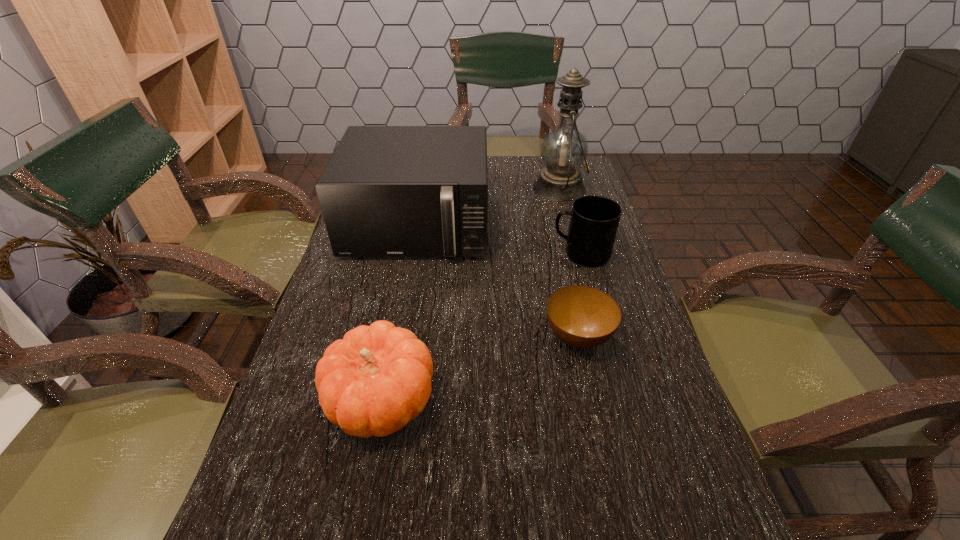
Find the location of a particular element. the tallest object is located at coordinates (564, 150).

This screenshot has height=540, width=960. In order to click on microwave oven in this screenshot , I will do `click(388, 191)`.

What are the coordinates of `mug` in the screenshot? It's located at (594, 221).

Locate an element on the screen. The width and height of the screenshot is (960, 540). pumpkin is located at coordinates (376, 379).

The height and width of the screenshot is (540, 960). I want to click on bowl, so click(584, 317).

In order to click on vacant space located 0.220m on the front of the tallest object in this screenshot , I will do `click(576, 251)`.

The width and height of the screenshot is (960, 540). In order to click on vacant space located on the front-facing side of the second tallest object in this screenshot , I will do `click(388, 385)`.

Locate an element on the screen. vacant area located on the side of the mug with the handle is located at coordinates (427, 254).

At what (x,y) coordinates should I click in order to perform the action: click on vacant region located on the side of the mug with the handle. Please return your answer as a coordinate pair (x, y). Image resolution: width=960 pixels, height=540 pixels. Looking at the image, I should click on (452, 254).

The image size is (960, 540). Find the location of `vacant space located on the side of the mug with the handle`. vacant space located on the side of the mug with the handle is located at coordinates pos(445,254).